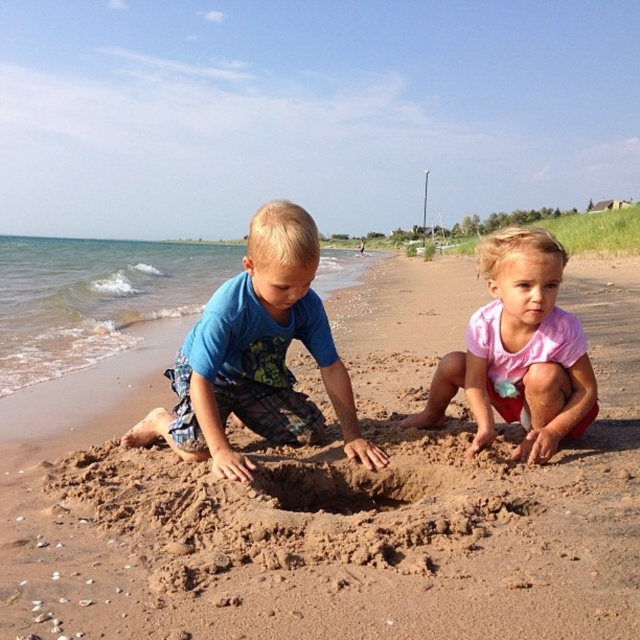
Who is shorter, brown sand at center or pink fabric at center?

pink fabric at center is shorter.

Who is higher up, brown sand at center or pink fabric at center?

brown sand at center is higher up.

Locate an element on the screen. brown sand at center is located at coordinates (339, 500).

Where is `brown sand at center`? This screenshot has width=640, height=640. brown sand at center is located at coordinates (339, 500).

Find the location of `blue cotton shirt at center`. blue cotton shirt at center is located at coordinates (257, 356).

Can you confirm if blue cotton shirt at center is positioned below pink fabric at center?

Indeed, blue cotton shirt at center is positioned under pink fabric at center.

Is point (205, 337) positioned behind point (481, 432)?

No, (205, 337) is closer to viewer.

Identify the location of blue cotton shirt at center. (257, 356).

Which is more to the right, brown sand at center or blue cotton shirt at center?

From the viewer's perspective, brown sand at center appears more on the right side.

Can you confirm if brown sand at center is smaller than blue cotton shirt at center?

Incorrect, brown sand at center is not smaller in size than blue cotton shirt at center.

Where is `brown sand at center`? Image resolution: width=640 pixels, height=640 pixels. brown sand at center is located at coordinates (339, 500).